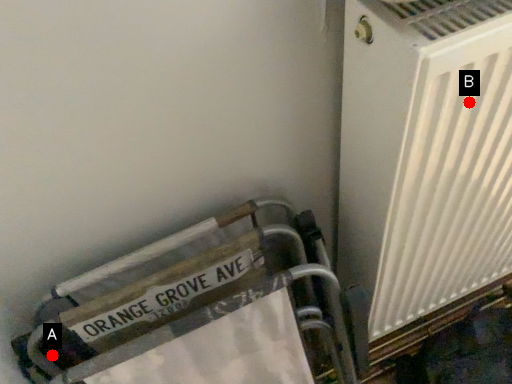
Question: Two points are circled on the image, labeled by A and B beside each circle. Which point is closer to the camera taking this photo?

Choices:
 (A) A is closer
 (B) B is closer

Answer: (B)